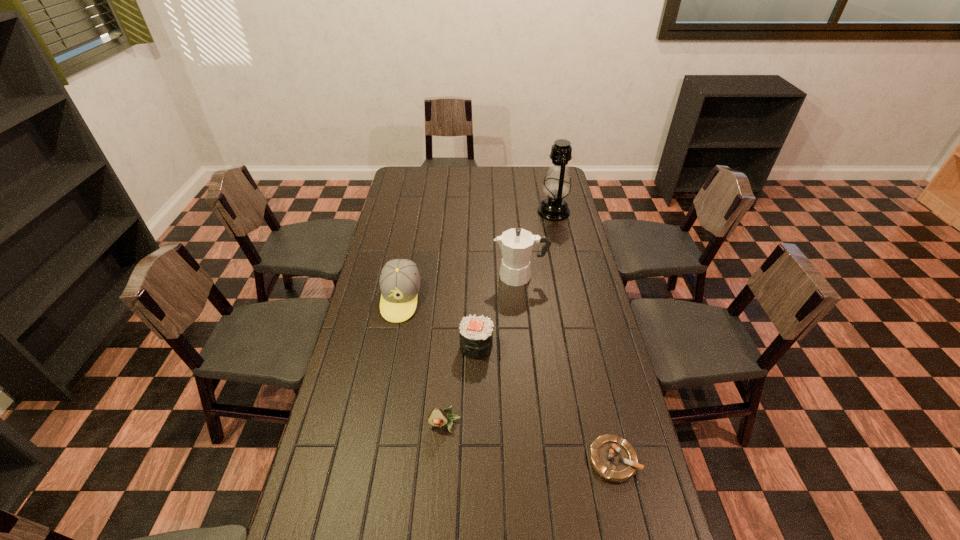
This screenshot has width=960, height=540. Find the location of `free space located on the back of the farthest object`. free space located on the back of the farthest object is located at coordinates (544, 168).

You are a GUI agent. You are given a task and a screenshot of the screen. Output one action in this format:
    pyautogui.click(x=<x>, y=<y>)
    Task: Click on the free space located 0.110m at the spout of the fifth shortest object
    
    Given the screenshot: What is the action you would take?
    point(466,276)

Image resolution: width=960 pixels, height=540 pixels. Find the location of `free region located at the spout of the fifth shortest object`. free region located at the spout of the fifth shortest object is located at coordinates (404, 276).

Where is `vacant area situated at the spout of the fifth shortest object`? The width and height of the screenshot is (960, 540). vacant area situated at the spout of the fifth shortest object is located at coordinates (478, 276).

You are a GUI agent. You are given a task and a screenshot of the screen. Output one action in this format:
    pyautogui.click(x=<x>, y=<y>)
    Task: Click on the vacant region located 0.330m on the front-facing side of the fourth shortest object
    Image resolution: width=960 pixels, height=540 pixels.
    Given the screenshot: What is the action you would take?
    pyautogui.click(x=381, y=403)

You are a GUI agent. You are given a task and a screenshot of the screen. Output one action in this format:
    pyautogui.click(x=<x>, y=<y>)
    Task: Click on the vacant region located on the front of the third nearest object
    The image size is (960, 540).
    Given the screenshot: What is the action you would take?
    pyautogui.click(x=476, y=431)

Find the location of `vacant space situated on the seed side of the avocado`. vacant space situated on the seed side of the avocado is located at coordinates (443, 453).

Where is `free region located on the left of the shortest object`? The image size is (960, 540). free region located on the left of the shortest object is located at coordinates (458, 460).

The height and width of the screenshot is (540, 960). Find the location of `object located in the left edge section of the desktop`. object located in the left edge section of the desktop is located at coordinates (399, 281).

At what (x,y) coordinates should I click in order to perform the action: click on oil lamp situated at the right edge. Please return your answer as a coordinate pair (x, y). The width and height of the screenshot is (960, 540). Looking at the image, I should click on (557, 185).